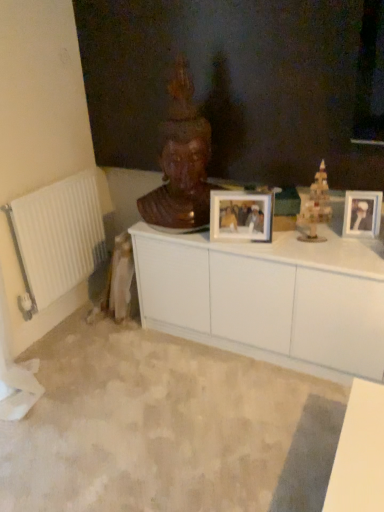
At what (x,y) coordinates should I click in order to perform the action: click on free space that is to the left of wooden tower at upper right. Please return your answer as a coordinate pair (x, y). This screenshot has width=384, height=512. Looking at the image, I should click on (281, 244).